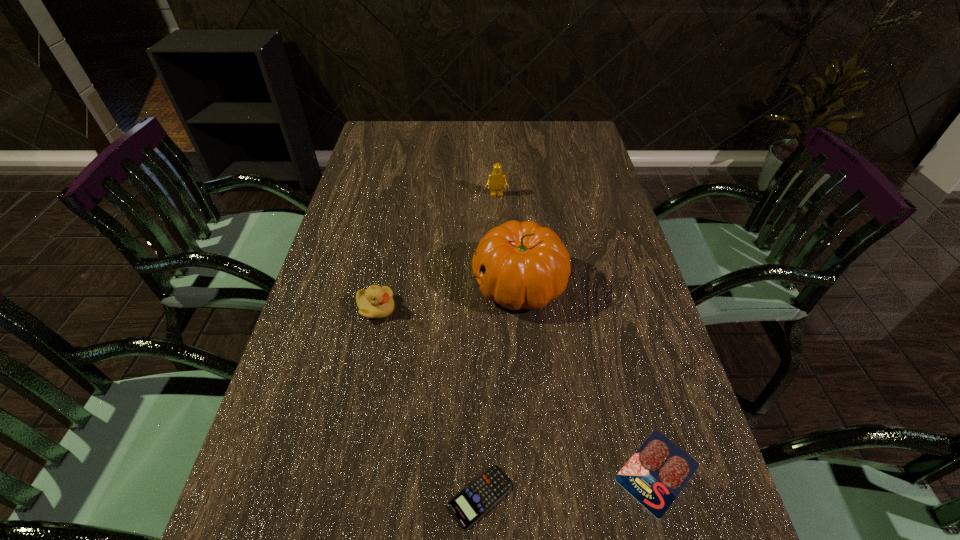
The height and width of the screenshot is (540, 960). I want to click on vacant space situated 0.240m on the face of the Lego, so click(x=499, y=251).

This screenshot has height=540, width=960. In order to click on vacant point located on the beak of the leftmost object in this screenshot , I will do `click(495, 309)`.

At what (x,y) coordinates should I click in order to perform the action: click on free location located 0.050m on the left of the calculator. Please return your answer as a coordinate pair (x, y). This screenshot has height=540, width=960. Looking at the image, I should click on (418, 497).

Locate an element on the screen. The width and height of the screenshot is (960, 540). free space located on the back of the rightmost object is located at coordinates (610, 295).

You are a GUI agent. You are given a task and a screenshot of the screen. Output one action in this format:
    pyautogui.click(x=<x>, y=<y>)
    Task: Click on the object present at the left edge
    
    Given the screenshot: What is the action you would take?
    pyautogui.click(x=376, y=302)

I want to click on object located at the right edge, so click(655, 475).

In the image, there is a desktop. Where is `vacant space at the far edge`? The height and width of the screenshot is (540, 960). vacant space at the far edge is located at coordinates (508, 129).

The width and height of the screenshot is (960, 540). In the image, there is a desktop. What are the coordinates of `free space at the left edge` in the screenshot? It's located at (350, 209).

This screenshot has height=540, width=960. In the image, there is a desktop. Find the location of `free space at the right edge`. free space at the right edge is located at coordinates (582, 258).

The image size is (960, 540). In the image, there is a desktop. Identify the location of blank space at the far right corner. (585, 147).